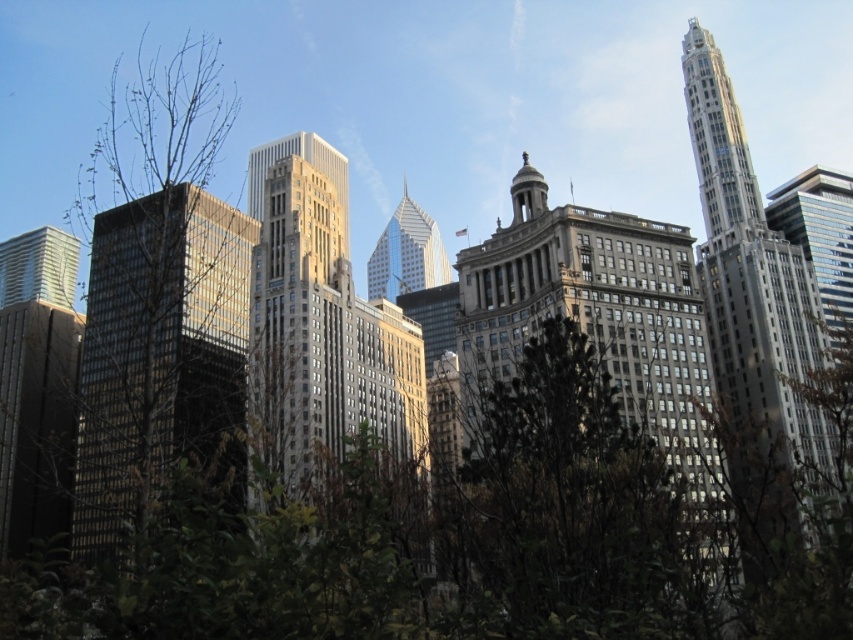
Based on the photo, is bare branches at left closer to camera compared to brown stone building at center?

Yes.

Who is positioned more to the left, bare branches at left or brown stone building at center?

bare branches at left is more to the left.

Does point (94, 285) come closer to viewer compared to point (537, 317)?

That is False.

Where is `bare branches at left`? The image size is (853, 640). bare branches at left is located at coordinates (157, 292).

What do you see at coordinates (448, 545) in the screenshot?
I see `green leafy bush at center` at bounding box center [448, 545].

Is green leafy bush at center closer to camera compared to brown stone building at center?

Yes, green leafy bush at center is in front of brown stone building at center.

Does point (526, 477) come farther from viewer compared to point (700, 556)?

No, (526, 477) is in front of (700, 556).

Where is `green leafy bush at center`? The width and height of the screenshot is (853, 640). green leafy bush at center is located at coordinates (448, 545).

Which is above, bare branches at left or matte glass skyscraper at left?

bare branches at left is above.

Between bare branches at left and matte glass skyscraper at left, which one appears on the left side from the viewer's perspective?

From the viewer's perspective, matte glass skyscraper at left appears more on the left side.

This screenshot has width=853, height=640. Describe the element at coordinates (157, 292) in the screenshot. I see `bare branches at left` at that location.

What are the coordinates of `bare branches at left` in the screenshot? It's located at (157, 292).